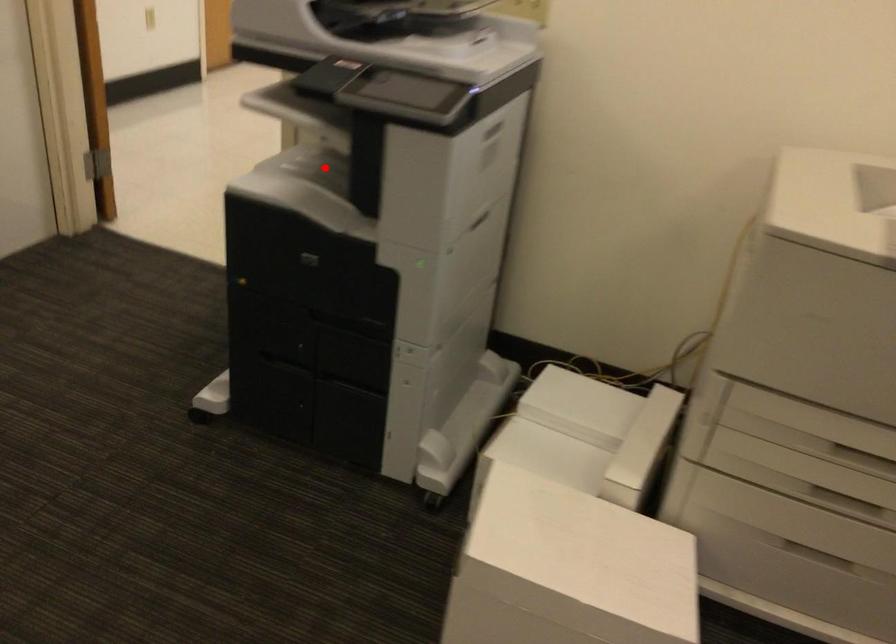
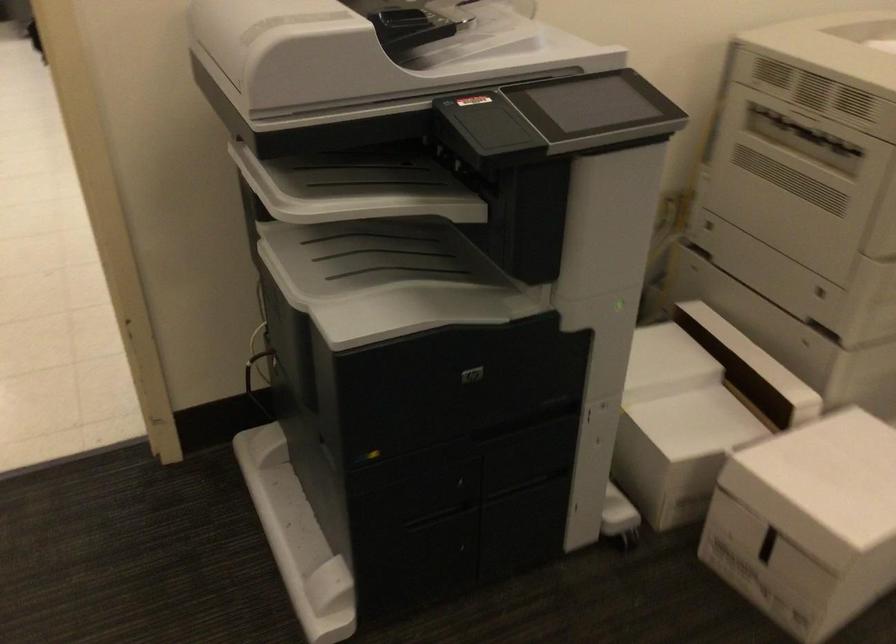
Find the pixel in the second image that matches the highlighted location in the first image.

(375, 258)